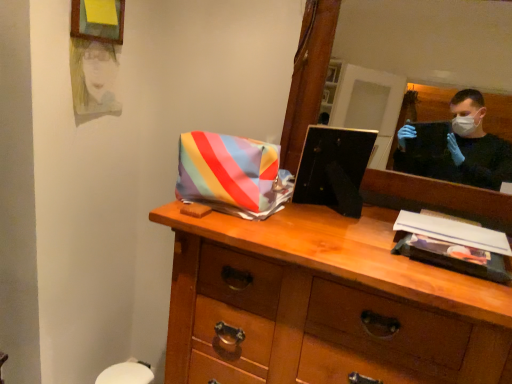
Question: Does wooden chest of drawers at center contain wooden mirror at upper right?

Choices:
 (A) yes
 (B) no

Answer: (B)

Question: Are wooden chest of drawers at center and wooden mirror at upper right far apart?

Choices:
 (A) yes
 (B) no

Answer: (A)

Question: Can you confirm if wooden chest of drawers at center is taller than wooden mirror at upper right?

Choices:
 (A) no
 (B) yes

Answer: (B)

Question: Is wooden chest of drawers at center closer to the viewer compared to wooden mirror at upper right?

Choices:
 (A) no
 (B) yes

Answer: (B)

Question: Is wooden chest of drawers at center bigger than wooden mirror at upper right?

Choices:
 (A) no
 (B) yes

Answer: (B)

Question: In the image, is matte yellow picture frame at upper left positioned in front of or behind wooden chest of drawers at center?

Choices:
 (A) front
 (B) behind

Answer: (B)

Question: Is matte yellow picture frame at upper left spatially inside wooden chest of drawers at center, or outside of it?

Choices:
 (A) outside
 (B) inside

Answer: (A)

Question: From the image's perspective, is matte yellow picture frame at upper left located above or below wooden chest of drawers at center?

Choices:
 (A) above
 (B) below

Answer: (A)

Question: From a real-world perspective, is matte yellow picture frame at upper left physically located above or below wooden chest of drawers at center?

Choices:
 (A) below
 (B) above

Answer: (B)

Question: Considering the positions of watercolor portrait at upper left and wooden chest of drawers at center in the image, is watercolor portrait at upper left taller or shorter than wooden chest of drawers at center?

Choices:
 (A) tall
 (B) short

Answer: (B)

Question: Relative to wooden chest of drawers at center, is watercolor portrait at upper left in front or behind?

Choices:
 (A) front
 (B) behind

Answer: (B)

Question: In terms of size, does watercolor portrait at upper left appear bigger or smaller than wooden chest of drawers at center?

Choices:
 (A) small
 (B) big

Answer: (A)

Question: From a real-world perspective, relative to wooden chest of drawers at center, is watercolor portrait at upper left vertically above or below?

Choices:
 (A) below
 (B) above

Answer: (B)

Question: In terms of height, does watercolor portrait at upper left look taller or shorter compared to wooden mirror at upper right?

Choices:
 (A) short
 (B) tall

Answer: (A)

Question: From a real-world perspective, relative to wooden mirror at upper right, is watercolor portrait at upper left vertically above or below?

Choices:
 (A) above
 (B) below

Answer: (B)